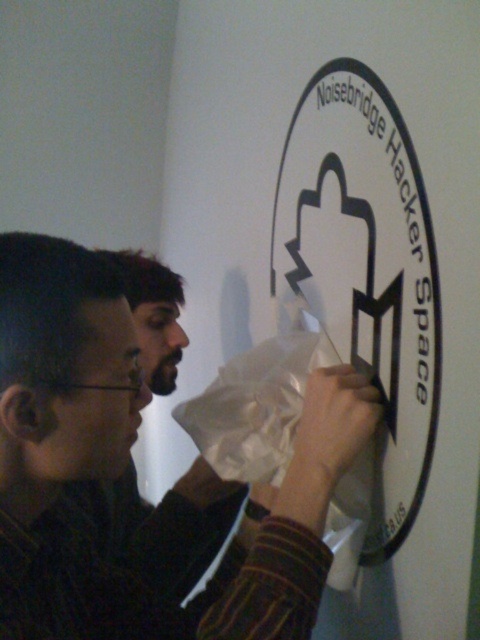
Which is above, matte black shirt at center or white matte paper bag at center?

white matte paper bag at center

Is matte black shirt at center closer to camera compared to white matte paper bag at center?

Yes, matte black shirt at center is closer to the viewer.

Where is `matte black shirt at center`? This screenshot has height=640, width=480. matte black shirt at center is located at coordinates pyautogui.click(x=124, y=464).

Does white matte sign at upper center appear on the left side of white matte paper bag at center?

Incorrect, white matte sign at upper center is not on the left side of white matte paper bag at center.

Can you confirm if white matte sign at upper center is positioned below white matte paper bag at center?

No.

The image size is (480, 640). Identify the location of white matte sign at upper center. (365, 268).

The image size is (480, 640). Identify the location of white matte sign at upper center. (365, 268).

Does matte black shirt at center lie in front of white matte sign at upper center?

Yes, matte black shirt at center is in front of white matte sign at upper center.

Does matte black shirt at center appear on the right side of white matte sign at upper center?

In fact, matte black shirt at center is to the left of white matte sign at upper center.

Does point (325, 452) lie behind point (391, 221)?

That is False.

Find the location of a particular element. This screenshot has height=640, width=480. matte black shirt at center is located at coordinates click(124, 464).